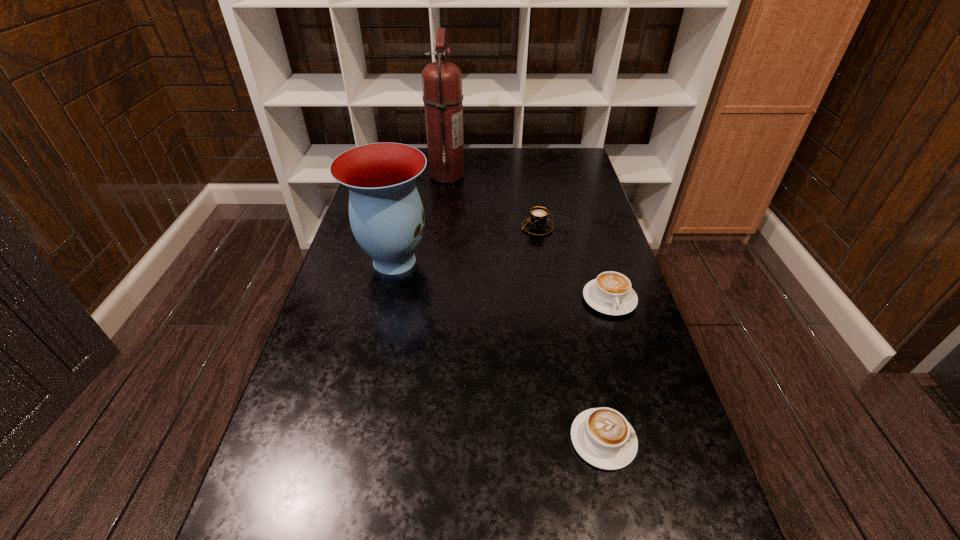
The image size is (960, 540). I want to click on free space between the tallest object and the farthest cappuccino, so tap(492, 201).

Find the location of a particular element. Image resolution: width=960 pixels, height=540 pixels. unoccupied area between the second farthest cappuccino and the nearest cappuccino is located at coordinates (606, 369).

The width and height of the screenshot is (960, 540). I want to click on free spot between the farthest cappuccino and the nearest object, so click(570, 334).

At what (x,y) coordinates should I click in order to perform the action: click on vacant space that's between the farthest cappuccino and the farthest object. Please return your answer as a coordinate pair (x, y). This screenshot has width=960, height=540. Looking at the image, I should click on (492, 201).

Locate an element on the screen. The image size is (960, 540). blank region between the nearest cappuccino and the farthest cappuccino is located at coordinates (570, 334).

The height and width of the screenshot is (540, 960). I want to click on free spot between the farthest cappuccino and the second nearest cappuccino, so click(x=573, y=264).

Image resolution: width=960 pixels, height=540 pixels. Find the location of `free space between the second nearest cappuccino and the second tallest object`. free space between the second nearest cappuccino and the second tallest object is located at coordinates (502, 280).

This screenshot has width=960, height=540. I want to click on object that stands as the second closest to the second nearest cappuccino, so click(x=602, y=437).

Locate an element on the screen. This screenshot has height=540, width=960. object that is the second closest to the nearest object is located at coordinates (386, 214).

Locate an element on the screen. The height and width of the screenshot is (540, 960). cappuccino that is the closest to the nearest cappuccino is located at coordinates (610, 293).